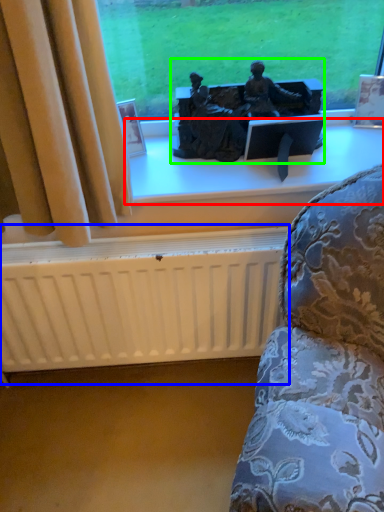
Question: Estimate the real-world distances between objects in this image. Which object is closer to window sill (highlighted by a red box), radiator (highlighted by a blue box) or sculpture (highlighted by a green box)?

Choices:
 (A) radiator
 (B) sculpture

Answer: (B)